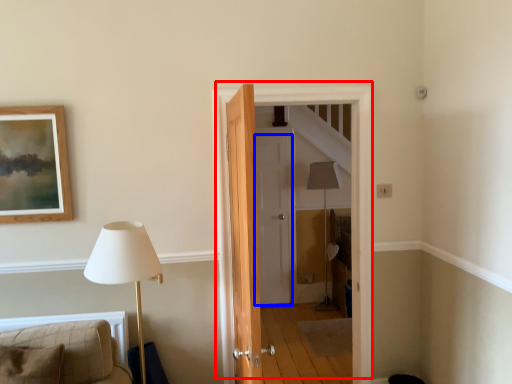
Question: Among these objects, which one is nearest to the camera, door (highlighted by a red box) or door (highlighted by a blue box)?

Choices:
 (A) door
 (B) door

Answer: (A)